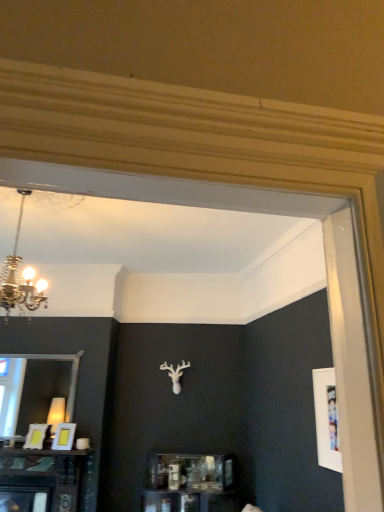
Question: Should I look upward or downward to see matte white picture frame at lower left, positioned as the second picture frame in left-to-right order?

Choices:
 (A) up
 (B) down

Answer: (B)

Question: From a real-world perspective, is matte yellow picture frame at lower left, marked as the first picture frame in a left-to-right arrangement, on top of matte white picture frame at lower left, acting as the 1th picture frame starting from the right?

Choices:
 (A) no
 (B) yes

Answer: (A)

Question: Considering the relative sizes of matte yellow picture frame at lower left, marked as the first picture frame in a left-to-right arrangement, and matte white picture frame at lower left, positioned as the second picture frame in left-to-right order, in the image provided, is matte yellow picture frame at lower left, marked as the first picture frame in a left-to-right arrangement, shorter than matte white picture frame at lower left, positioned as the second picture frame in left-to-right order,?

Choices:
 (A) no
 (B) yes

Answer: (B)

Question: Does matte yellow picture frame at lower left, the second picture frame positioned from the right, turn towards matte white picture frame at lower left, positioned as the second picture frame in left-to-right order?

Choices:
 (A) yes
 (B) no

Answer: (B)

Question: From the image's perspective, is matte yellow picture frame at lower left, marked as the first picture frame in a left-to-right arrangement, on top of matte white picture frame at lower left, acting as the 1th picture frame starting from the right?

Choices:
 (A) yes
 (B) no

Answer: (B)

Question: Is matte yellow picture frame at lower left, the second picture frame positioned from the right, positioned with its back to matte white picture frame at lower left, acting as the 1th picture frame starting from the right?

Choices:
 (A) yes
 (B) no

Answer: (B)

Question: Considering the relative sizes of matte yellow picture frame at lower left, marked as the first picture frame in a left-to-right arrangement, and matte white picture frame at lower left, acting as the 1th picture frame starting from the right, in the image provided, is matte yellow picture frame at lower left, marked as the first picture frame in a left-to-right arrangement, wider than matte white picture frame at lower left, acting as the 1th picture frame starting from the right,?

Choices:
 (A) yes
 (B) no

Answer: (B)

Question: From a real-world perspective, is matte white picture frame at lower left, positioned as the second picture frame in left-to-right order, positioned over matte yellow picture frame at lower left, the second picture frame positioned from the right, based on gravity?

Choices:
 (A) yes
 (B) no

Answer: (A)

Question: From the image's perspective, is matte white picture frame at lower left, acting as the 1th picture frame starting from the right, over matte yellow picture frame at lower left, marked as the first picture frame in a left-to-right arrangement?

Choices:
 (A) yes
 (B) no

Answer: (A)

Question: Does matte white picture frame at lower left, acting as the 1th picture frame starting from the right, have a lesser height compared to matte yellow picture frame at lower left, marked as the first picture frame in a left-to-right arrangement?

Choices:
 (A) no
 (B) yes

Answer: (A)

Question: Would you say matte white picture frame at lower left, acting as the 1th picture frame starting from the right, is a long distance from matte yellow picture frame at lower left, the second picture frame positioned from the right?

Choices:
 (A) yes
 (B) no

Answer: (B)

Question: Is matte yellow picture frame at lower left, marked as the first picture frame in a left-to-right arrangement, completely or partially inside matte white picture frame at lower left, acting as the 1th picture frame starting from the right?

Choices:
 (A) no
 (B) yes

Answer: (A)

Question: Is matte white picture frame at lower left, acting as the 1th picture frame starting from the right, at the left side of matte yellow picture frame at lower left, the second picture frame positioned from the right?

Choices:
 (A) yes
 (B) no

Answer: (B)

Question: Is matte yellow picture frame at lower left, the second picture frame positioned from the right, to the left or to the right of matte white picture frame at lower left, acting as the 1th picture frame starting from the right, in the image?

Choices:
 (A) left
 (B) right

Answer: (A)